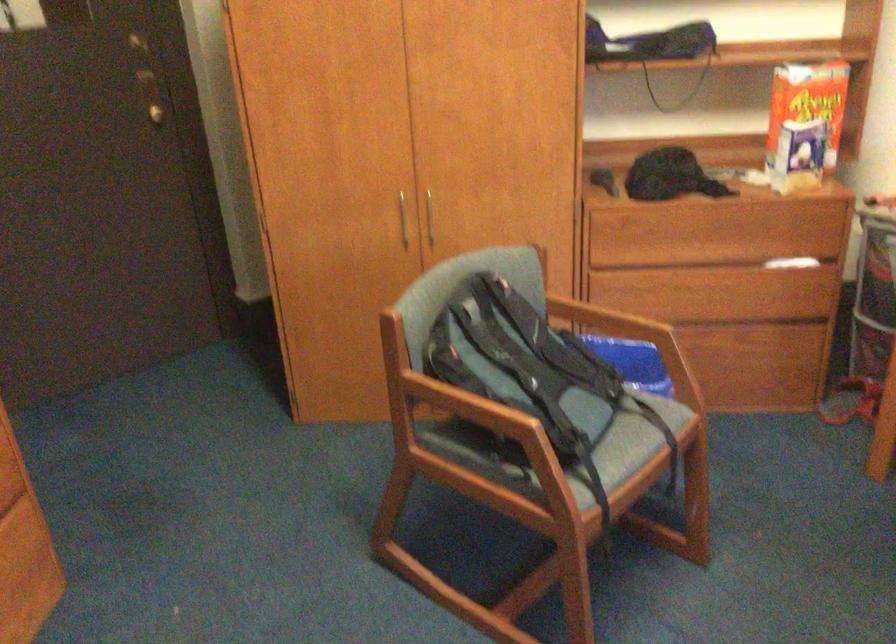
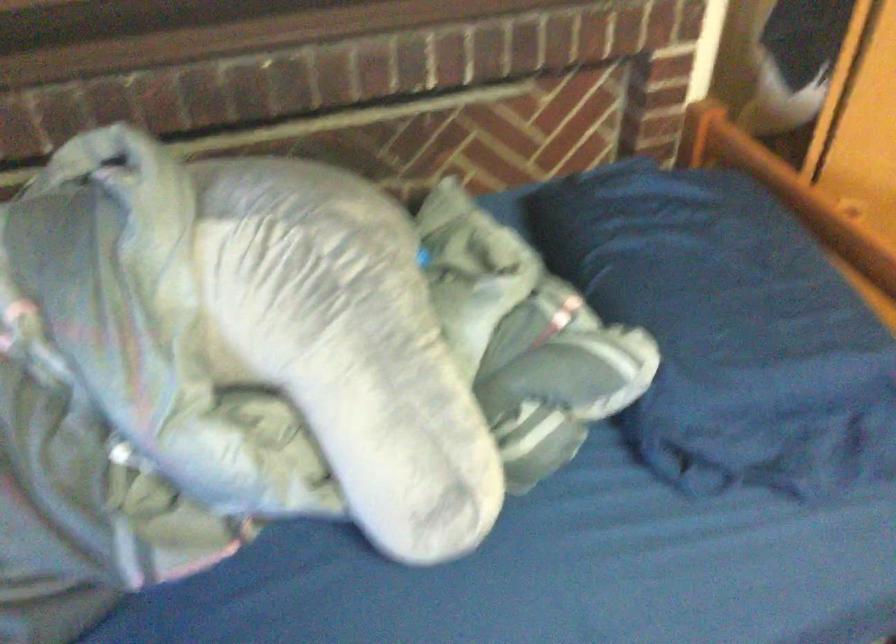
The first image is from the beginning of the video and the second image is from the end. How did the camera likely rotate when shooting the video?

The camera rotated toward left-down.